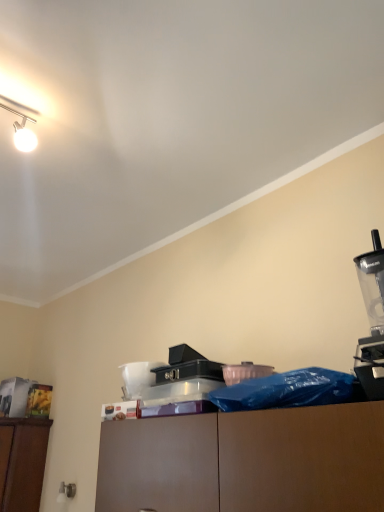
Question: Is black plastic case at center inside the boundaries of transparent plastic blender at right, or outside?

Choices:
 (A) inside
 (B) outside

Answer: (B)

Question: Looking at their shapes, would you say black plastic case at center is wider or thinner than transparent plastic blender at right?

Choices:
 (A) wide
 (B) thin

Answer: (B)

Question: Considering the positions of point (200, 359) and point (360, 378), is point (200, 359) closer or farther from the camera than point (360, 378)?

Choices:
 (A) closer
 (B) farther

Answer: (B)

Question: Considering the positions of transparent plastic blender at right and black plastic case at center in the image, is transparent plastic blender at right taller or shorter than black plastic case at center?

Choices:
 (A) short
 (B) tall

Answer: (B)

Question: Considering the positions of point (380, 388) and point (198, 358), is point (380, 388) closer or farther from the camera than point (198, 358)?

Choices:
 (A) closer
 (B) farther

Answer: (A)

Question: Relative to black plastic case at center, is transparent plastic blender at right in front or behind?

Choices:
 (A) behind
 (B) front

Answer: (B)

Question: Considering the positions of transparent plastic blender at right and black plastic case at center in the image, is transparent plastic blender at right wider or thinner than black plastic case at center?

Choices:
 (A) thin
 (B) wide

Answer: (B)